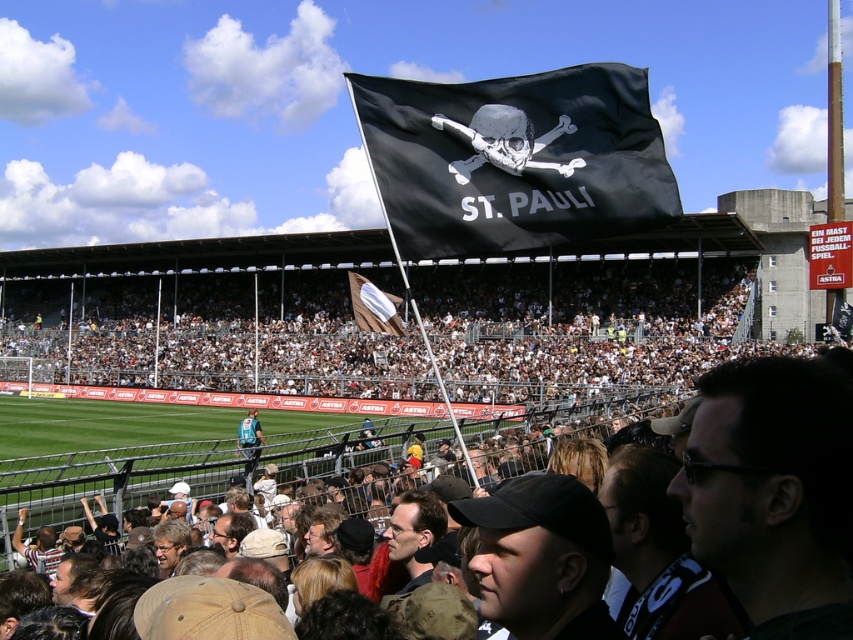
Question: Which of the following is the farthest from the observer?

Choices:
 (A) (432, 234)
 (B) (512, 360)
 (C) (372, 285)

Answer: (B)

Question: Does black fabric flag at upper center appear on the left side of brown fabric flag at center?

Choices:
 (A) no
 (B) yes

Answer: (A)

Question: Does black fabric flag at upper center appear under brown fabric flag at center?

Choices:
 (A) yes
 (B) no

Answer: (B)

Question: Which object is farther from the camera taking this photo?

Choices:
 (A) brown fabric flag at center
 (B) white plastic stadium seats at center

Answer: (B)

Question: Does white plastic stadium seats at center have a smaller size compared to black fabric flag at upper center?

Choices:
 (A) yes
 (B) no

Answer: (B)

Question: Which of the following is the farthest from the observer?

Choices:
 (A) (404, 333)
 (B) (407, 92)

Answer: (A)